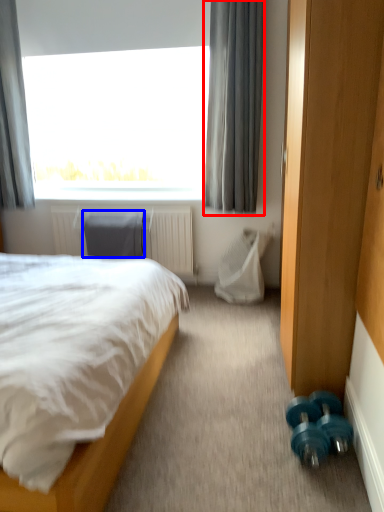
Question: Which of the following is the closest to the observer, curtain (highlighted by a red box) or swivel chair (highlighted by a blue box)?

Choices:
 (A) curtain
 (B) swivel chair

Answer: (A)